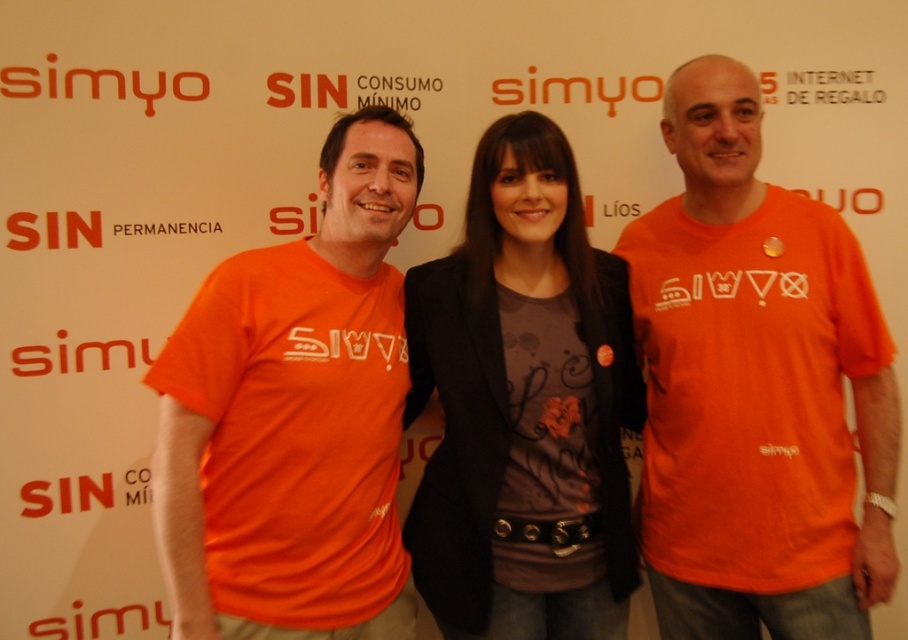
Can you confirm if orange matte t-shirt at center is shorter than matte black blazer at center?

No, orange matte t-shirt at center is not shorter than matte black blazer at center.

Identify the location of orange matte t-shirt at center. (756, 388).

Who is more distant from viewer, (212, 538) or (480, 317)?

Positioned behind is point (480, 317).

Image resolution: width=908 pixels, height=640 pixels. Describe the element at coordinates (294, 417) in the screenshot. I see `orange matte t-shirt at left` at that location.

Between point (193, 307) and point (430, 586), which one is positioned behind?

Positioned behind is point (430, 586).

Where is `orange matte t-shirt at left`? orange matte t-shirt at left is located at coordinates (294, 417).

Is orange matte t-shirt at center bigger than orange matte t-shirt at left?

Actually, orange matte t-shirt at center might be smaller than orange matte t-shirt at left.

Does orange matte t-shirt at center have a greater height compared to orange matte t-shirt at left?

Indeed, orange matte t-shirt at center has a greater height compared to orange matte t-shirt at left.

This screenshot has height=640, width=908. Describe the element at coordinates (756, 388) in the screenshot. I see `orange matte t-shirt at center` at that location.

Locate an element on the screen. This screenshot has width=908, height=640. orange matte t-shirt at center is located at coordinates (756, 388).